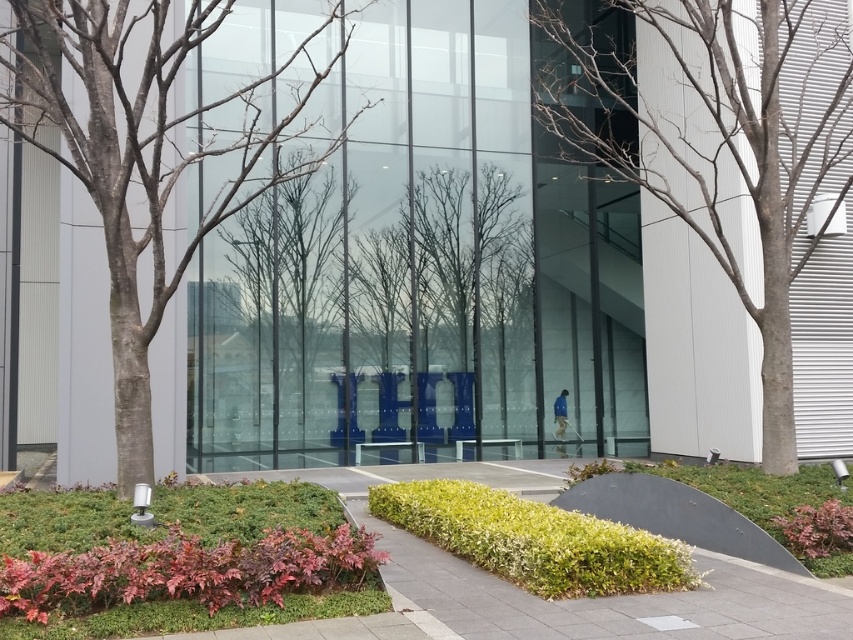
Question: Which point is farther to the camera?

Choices:
 (A) bare wood tree at left
 (B) green leafy hedge at lower center
 (C) bare branches at center
 (D) bare wood tree at center

Answer: (D)

Question: Is bare wood tree at left above green grass at lower center?

Choices:
 (A) no
 (B) yes

Answer: (B)

Question: Does bare wood tree at left have a larger size compared to green grass at lower center?

Choices:
 (A) yes
 (B) no

Answer: (B)

Question: Which point is farther to the camera?

Choices:
 (A) green grass at lower center
 (B) purple-leaved hedge at lower left
 (C) bare branches at center
 (D) green leafy hedge at lower center

Answer: (C)

Question: Which point appears closest to the camera in this image?

Choices:
 (A) (316, 182)
 (B) (811, 104)

Answer: (B)

Question: Is bare wood tree at left positioned in front of purple-leaved hedge at lower left?

Choices:
 (A) no
 (B) yes

Answer: (A)